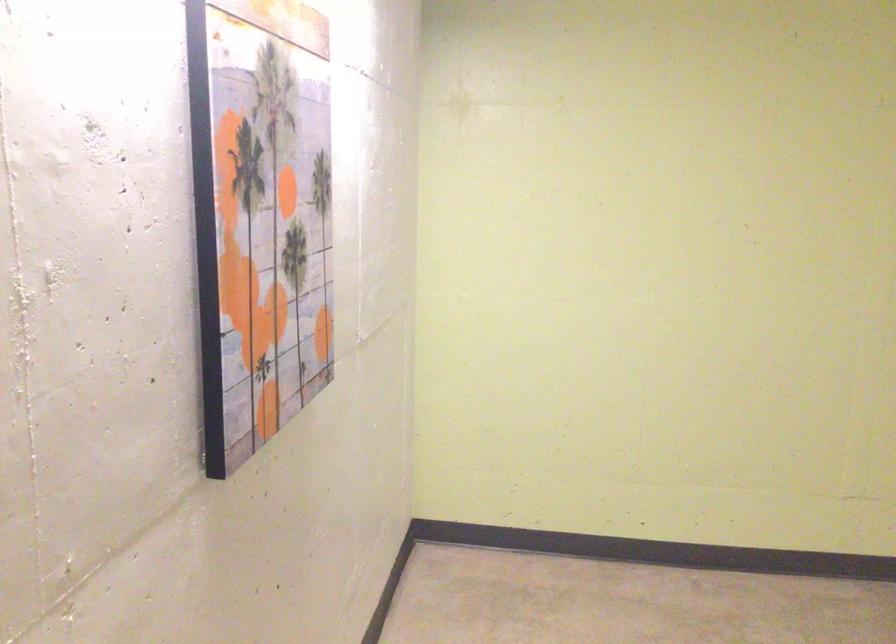
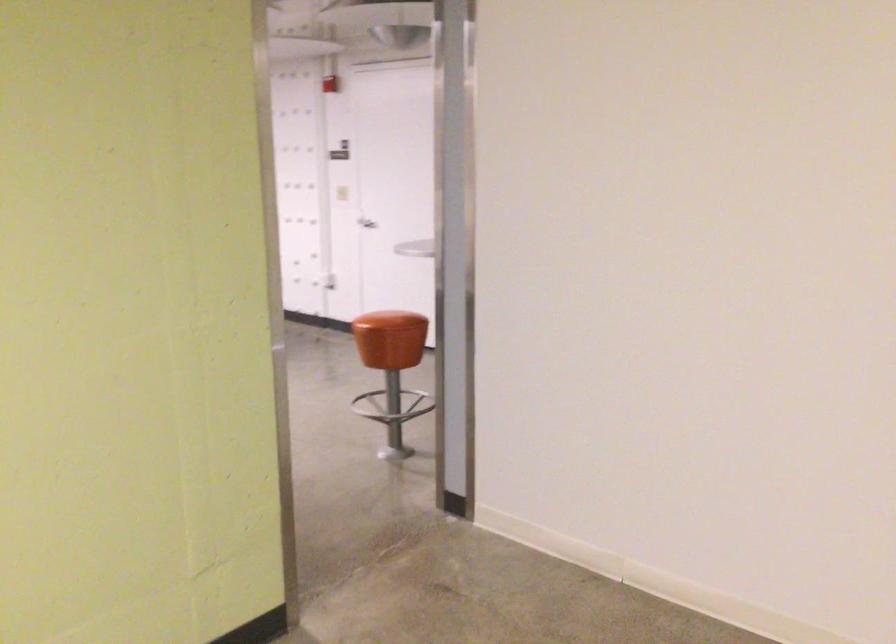
Question: The camera is either moving clockwise (left) or counter-clockwise (right) around the object. The first image is from the beginning of the video and the second image is from the end. Is the camera moving left or right when shooting the video?

Choices:
 (A) Left
 (B) Right

Answer: (A)